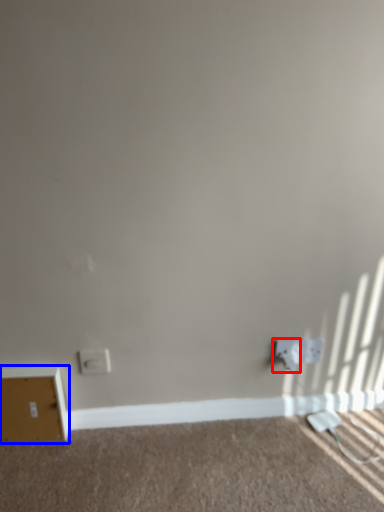
Question: Which point is closer to the camera, electric outlet (highlighted by a red box) or file cabinet (highlighted by a blue box)?

Choices:
 (A) electric outlet
 (B) file cabinet

Answer: (B)